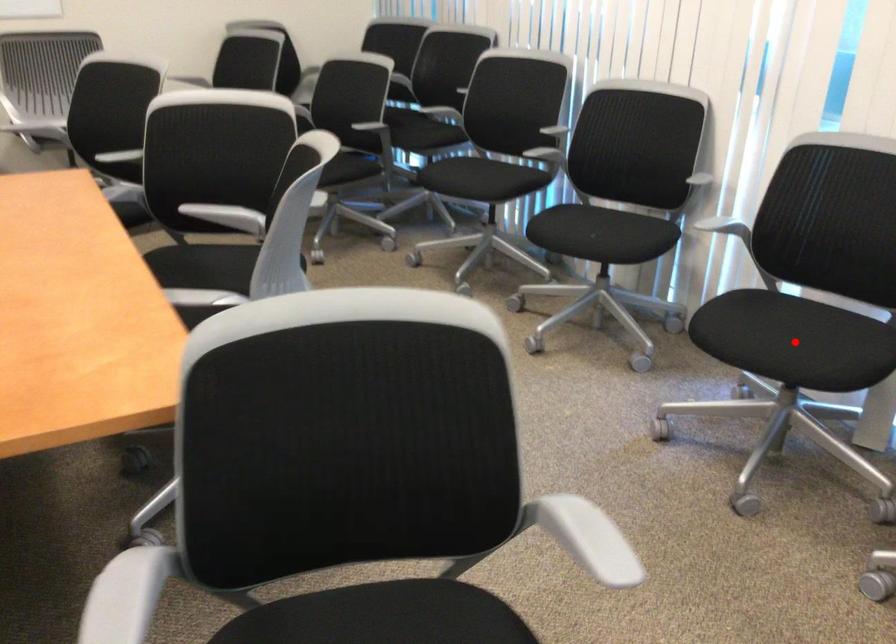
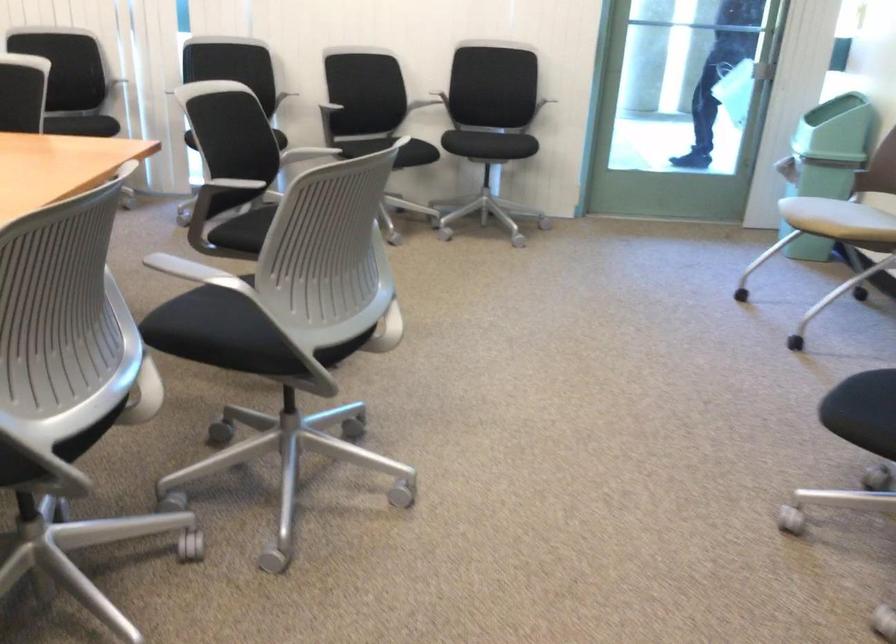
Question: I am providing you with two images of the same scene from different viewpoints. A red point is marked on the first image. Is the red point's position out of view in image 2?

Choices:
 (A) Yes
 (B) No

Answer: (A)